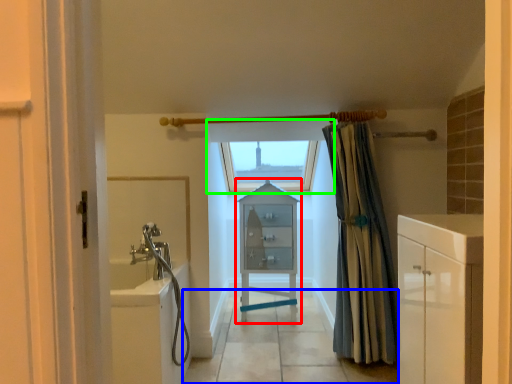
Question: Based on their relative distances, which object is farther from cabinetry (highlighted by a red box)? Choose from path (highlighted by a blue box) and window (highlighted by a green box).

Choices:
 (A) path
 (B) window

Answer: (B)